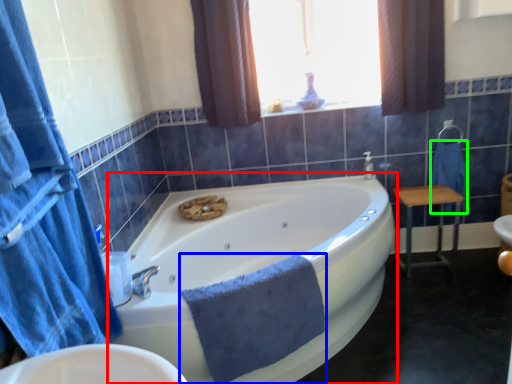
Question: Which object is positioned closest to bathtub (highlighted by a red box)? Select from bath towel (highlighted by a blue box) and bath towel (highlighted by a green box).

Choices:
 (A) bath towel
 (B) bath towel

Answer: (A)